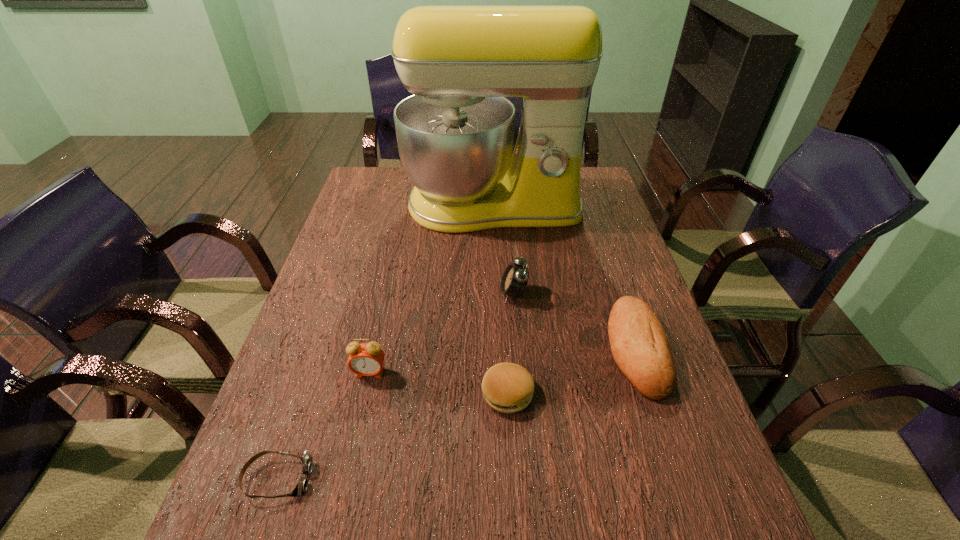
Where is `vacant space that's between the second shortest object and the right alarm clock`? vacant space that's between the second shortest object and the right alarm clock is located at coordinates (511, 343).

Locate an element on the screen. free space between the farther alarm clock and the mixer is located at coordinates (503, 250).

Where is `free space between the bread and the left alarm clock`? free space between the bread and the left alarm clock is located at coordinates (503, 361).

Where is `empty space between the patty and the nearer alarm clock`? empty space between the patty and the nearer alarm clock is located at coordinates (439, 383).

The image size is (960, 540). In order to click on free space between the mixer and the patty in this screenshot , I will do `click(500, 300)`.

Identify which object is the second nearest to the goggles. Please provide its 2D coordinates. Your answer should be formatted as a tuple, i.e. [(x, y)], where the tuple contains the x and y coordinates of a point satisfying the conditions above.

[(508, 388)]

Locate which object is the fourth closest to the fifth tallest object. Please provide its 2D coordinates. Your answer should be formatted as a tuple, i.e. [(x, y)], where the tuple contains the x and y coordinates of a point satisfying the conditions above.

[(307, 460)]

Image resolution: width=960 pixels, height=540 pixels. Find the location of `blank space that satisfies the following two spatial constraints: 1. on the side of the patty with the control knob; 2. on the left side of the mixer`. blank space that satisfies the following two spatial constraints: 1. on the side of the patty with the control knob; 2. on the left side of the mixer is located at coordinates (500, 393).

Locate an element on the screen. vacant space that satisfies the following two spatial constraints: 1. on the face of the left alarm clock; 2. on the right side of the patty is located at coordinates (365, 393).

What are the coordinates of `free space that satisfies the following two spatial constraints: 1. on the side of the farthest object with the control knob; 2. on the front-facing side of the leftmost object` in the screenshot? It's located at (503, 478).